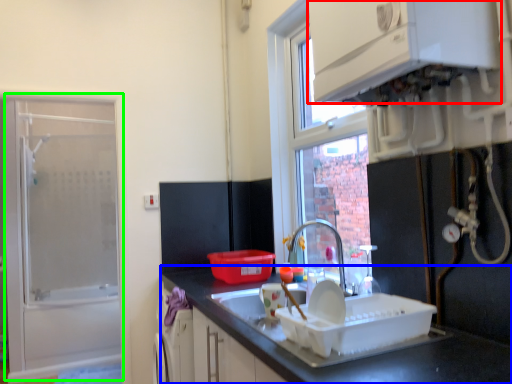
Question: Based on their relative distances, which object is farther from cabinetry (highlighted by a red box)? Choose from countertop (highlighted by a blue box) and screen door (highlighted by a green box).

Choices:
 (A) countertop
 (B) screen door

Answer: (B)